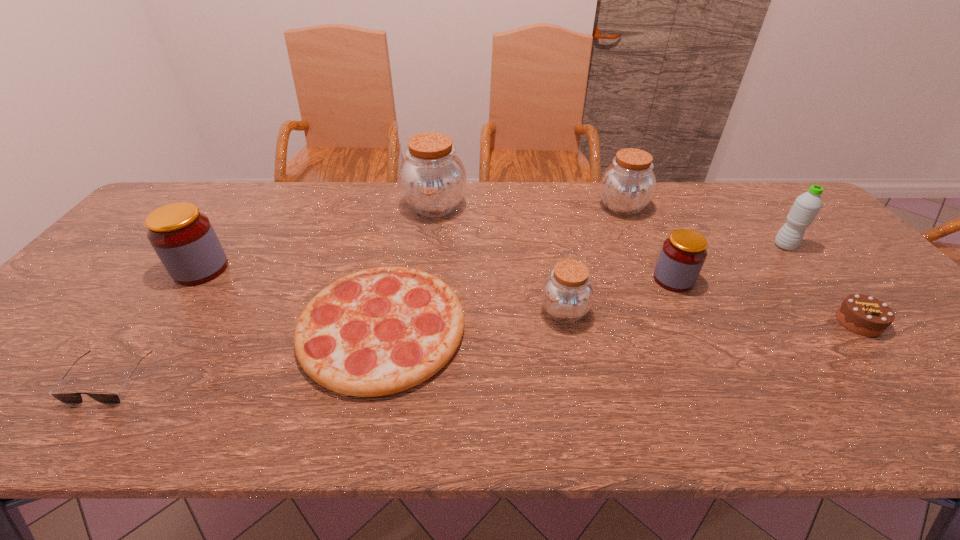
Where is `the seventh tallest object`? the seventh tallest object is located at coordinates (862, 314).

Identify the location of brown chocolate cake. Image resolution: width=960 pixels, height=540 pixels. (862, 314).

Find the location of `sunglasses`. sunglasses is located at coordinates (67, 398).

Image resolution: width=960 pixels, height=540 pixels. I want to click on pizza, so click(x=379, y=331).

Identify the location of vacant space located on the right of the biggest brown jar. The image size is (960, 540). (568, 206).

This screenshot has width=960, height=540. I want to click on vacant space situated 0.370m on the front of the water bottle, so click(x=876, y=356).

Find the location of a particular element. This screenshot has height=540, width=960. free space located on the right of the rightmost brown jar is located at coordinates [x=669, y=207].

Identify the location of free space located on the right of the left red jar. Image resolution: width=960 pixels, height=540 pixels. (355, 269).

Where is `vacant space situated 0.080m on the back of the smaller red jar`? vacant space situated 0.080m on the back of the smaller red jar is located at coordinates (659, 248).

Image resolution: width=960 pixels, height=540 pixels. What are the coordinates of `free space located 0.090m on the right of the third jar from right to left` in the screenshot? It's located at [x=626, y=312].